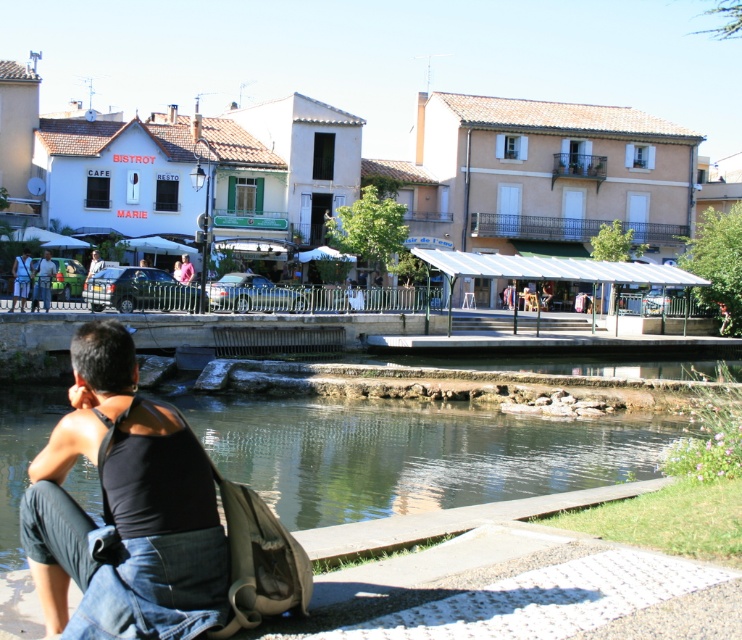
Who is positioned more to the left, clear water at lower center or matte black shirt at lower left?

From the viewer's perspective, matte black shirt at lower left appears more on the left side.

Is clear water at lower center above matte black shirt at lower left?

No, clear water at lower center is not above matte black shirt at lower left.

The width and height of the screenshot is (742, 640). I want to click on clear water at lower center, so click(413, 452).

At what (x,y) coordinates should I click in order to perform the action: click on clear water at lower center. Please return your answer as a coordinate pair (x, y). The width and height of the screenshot is (742, 640). Looking at the image, I should click on (413, 452).

Does clear water at lower center come in front of matte black shirt at left?

Yes, it is in front of matte black shirt at left.

Who is more forward, (223, 451) or (13, 275)?

Point (223, 451)

Image resolution: width=742 pixels, height=640 pixels. Find the location of `clear water at lower center`. clear water at lower center is located at coordinates (413, 452).

Is matte black shirt at lower left below matte black shirt at left?

Correct, matte black shirt at lower left is located below matte black shirt at left.

Looking at this image, who is more distant from viewer, (32, 300) or (13, 298)?

The point (32, 300) is more distant.

Describe the element at coordinates (42, 280) in the screenshot. The image size is (742, 640). I see `matte black shirt at lower left` at that location.

The width and height of the screenshot is (742, 640). I want to click on matte black shirt at lower left, so click(42, 280).